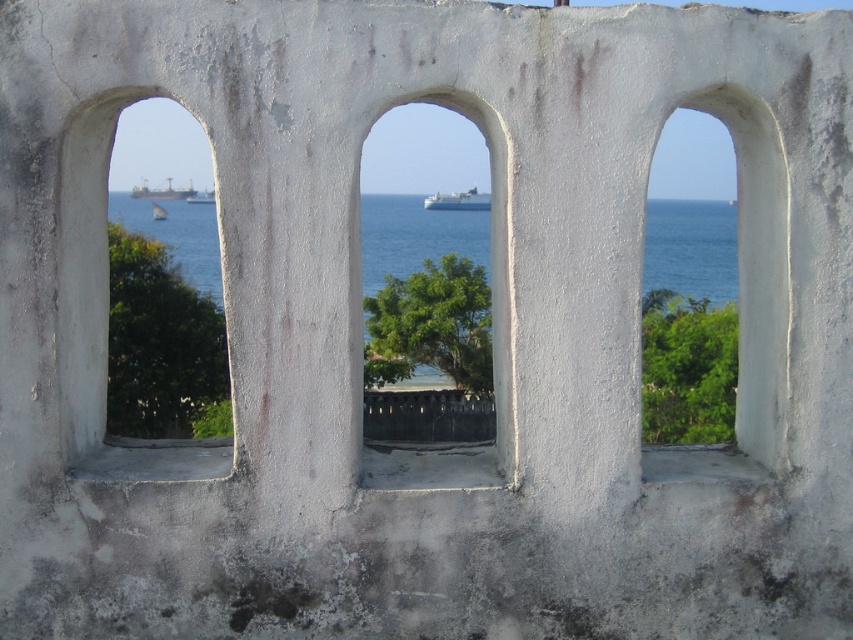
You are standing in front of the stone wall with three arches. You notice a specific point marked at coordinates (492, 256). Which object is exactly at that point?

The white concrete arch at center is located at point (492, 256).

You are standing in front of the stone wall with three arched openings. There is a point marked at coordinates point [498,240]. If you want to touch this point with a stick that is 5 meters long, will the stick be long enough?

The distance between you and the point [498,240] is 5.29 meters, so the 5 meter stick is not long enough to reach it.

You are standing in front of the stone wall with three arched openings. There is a specific point at coordinates point (109, 108) on the wall. If you want to place a decorative plaque at this point, and the plaque requires a mounting depth of 4 meters, will the wall be deep enough to accommodate it?

The distance of point (109, 108) from viewer is 5.12 meters, so yes, the wall is deep enough to accommodate the plaque since the required depth is less than the available distance.